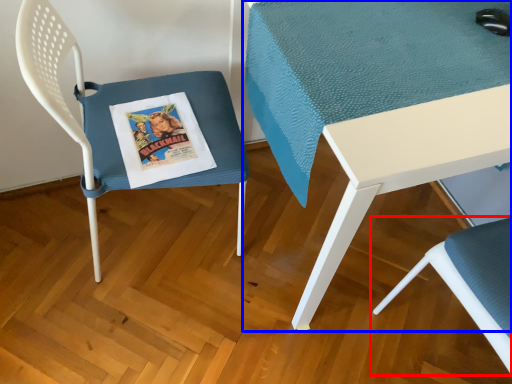
Question: Which of the following is the farthest to the observer, chair (highlighted by a red box) or table (highlighted by a blue box)?

Choices:
 (A) chair
 (B) table

Answer: (B)